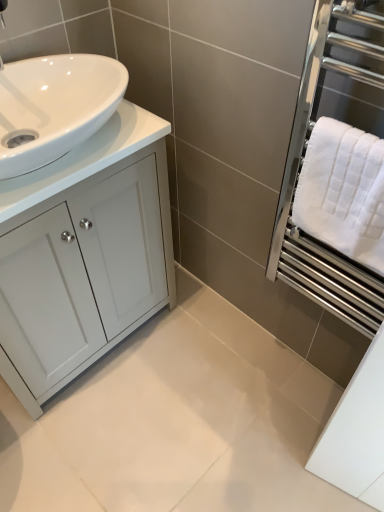
Question: Is point (357, 179) positioned closer to the camera than point (299, 233)?

Choices:
 (A) closer
 (B) farther

Answer: (A)

Question: In terms of size, does white textured towel at right appear bigger or smaller than white textured towel at right?

Choices:
 (A) big
 (B) small

Answer: (B)

Question: Estimate the real-world distances between objects in this image. Which object is farther from the white textured towel at right?

Choices:
 (A) white glossy cabinet at left
 (B) white textured towel at right
 (C) white glossy countertop at left

Answer: (A)

Question: Estimate the real-world distances between objects in this image. Which object is closer to the white textured towel at right?

Choices:
 (A) white textured towel at right
 (B) white glossy cabinet at left
 (C) white glossy countertop at left

Answer: (A)